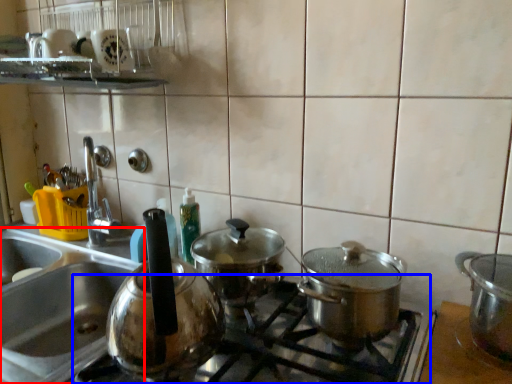
Question: Among these objects, which one is nearest to the camera, sink (highlighted by a red box) or gas stove (highlighted by a blue box)?

Choices:
 (A) sink
 (B) gas stove

Answer: (B)